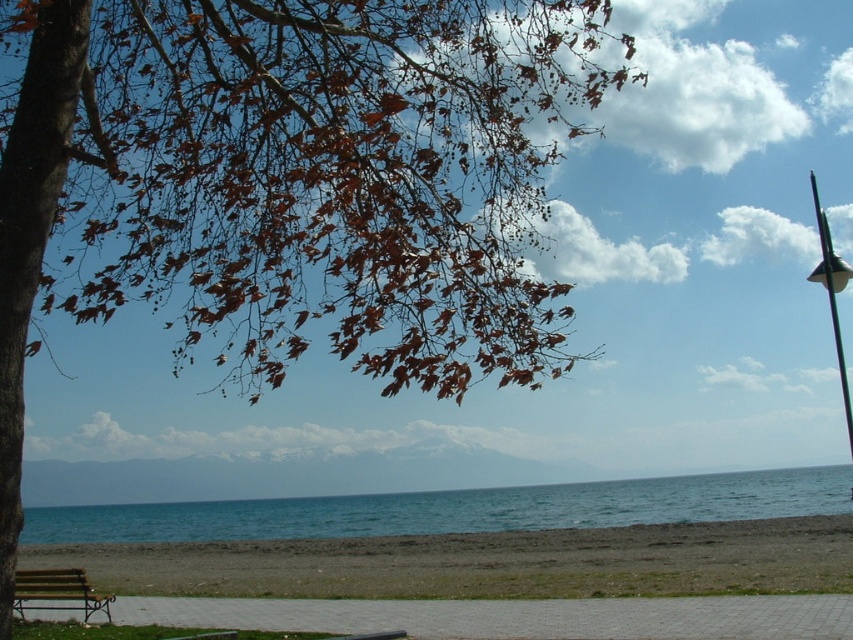
Does brown sand at lower left appear on the right side of wooden park bench at lower left?

Indeed, brown sand at lower left is positioned on the right side of wooden park bench at lower left.

Looking at this image, who is more distant from viewer, (558, 554) or (108, 600)?

The point (558, 554) is more distant.

Who is more forward, (279,579) or (88,598)?

Point (88,598) is more forward.

Locate an element on the screen. brown sand at lower left is located at coordinates (485, 563).

Between brown sand at lower left and blue water at center, which one appears on the right side from the viewer's perspective?

blue water at center is more to the right.

Does point (834, 576) lie in front of point (166, 525)?

Yes, it is.

Locate an element on the screen. This screenshot has width=853, height=640. brown sand at lower left is located at coordinates (485, 563).

Which is in front, point (712, 492) or point (103, 595)?

Point (103, 595) is in front.

Looking at this image, who is positioned more to the left, blue water at center or wooden park bench at lower left?

From the viewer's perspective, wooden park bench at lower left appears more on the left side.

Describe the element at coordinates (456, 509) in the screenshot. I see `blue water at center` at that location.

Locate an element on the screen. This screenshot has height=640, width=853. blue water at center is located at coordinates (456, 509).